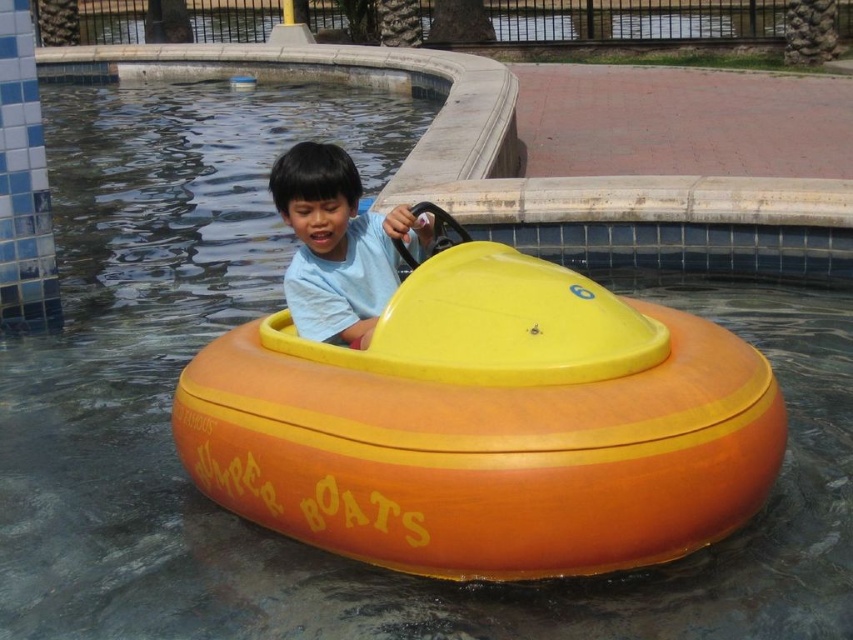
You are standing in front of the bumper boat scene. There are two points marked in the image. The first point is at coordinate point (544,406) and the second point is at coordinate point (343,180). Which point is closer to you?

Point (544,406) is closer to the camera than point (343,180).

You are a parent trying to decide which bumper boat to choose for your child. The orange matte bumper boat at center and the matte yellow bumper boat at center are available. Based on their sizes, which one is wider?

The orange matte bumper boat at center is wider than the matte yellow bumper boat at center.

You are a parent trying to choose between two bumper boats for your child. The orange matte bumper boat at center and the matte yellow bumper boat at center are both available. Based on their height, which one might be more suitable for a child who prefers a taller seat to see better?

The orange matte bumper boat at center is taller than the matte yellow bumper boat at center, so it would be more suitable for a child who prefers a taller seat to see better.